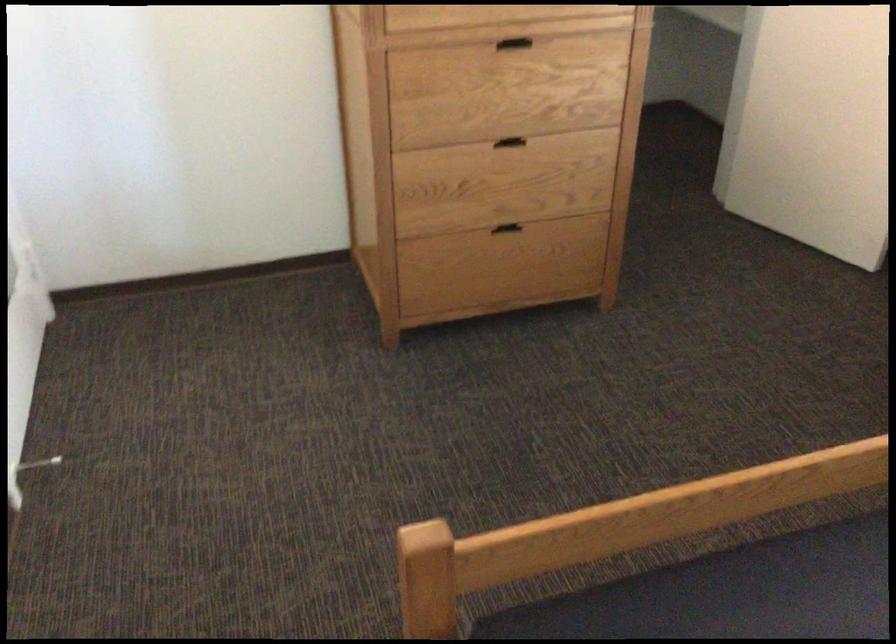
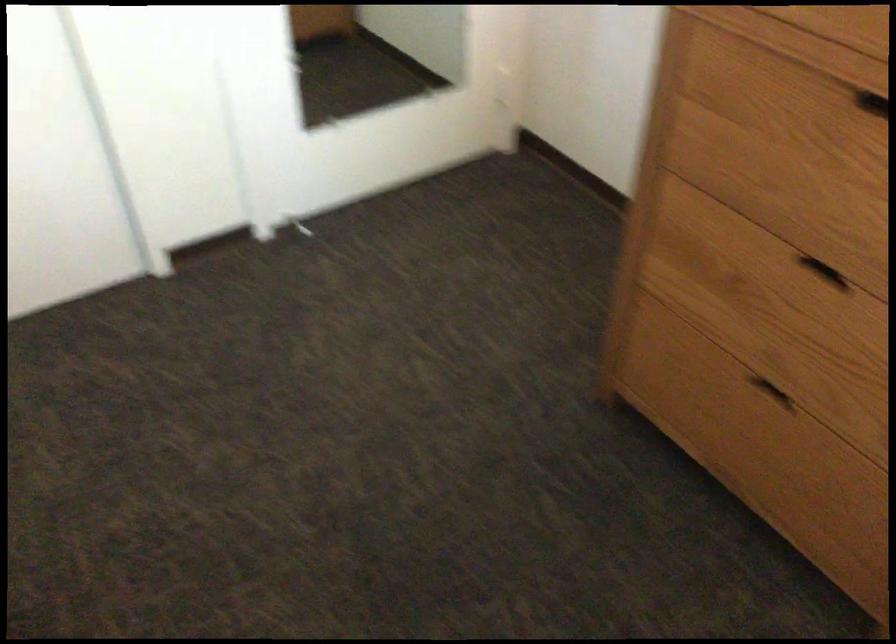
Locate, in the second image, the point that corresponds to (x=497, y=230) in the first image.

(770, 392)